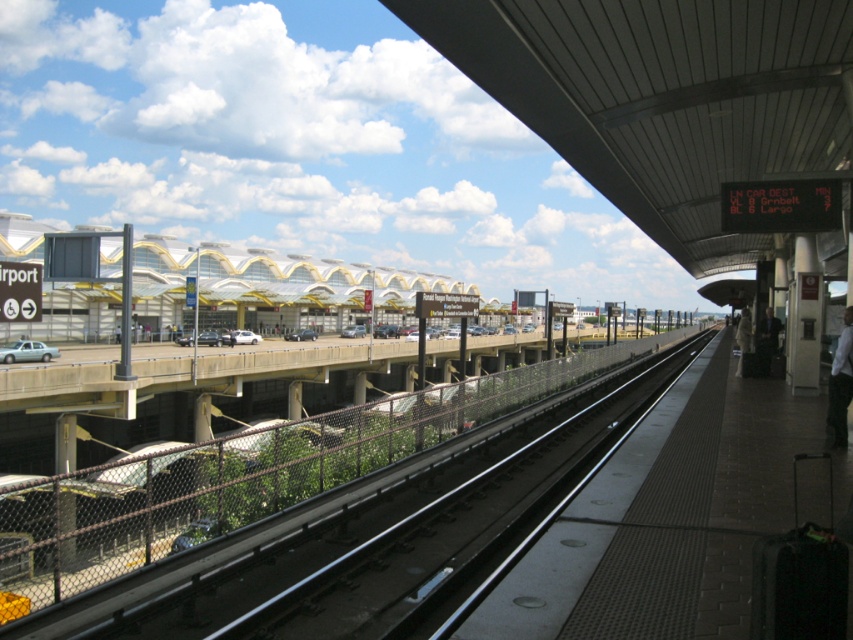
Question: Is metallic smooth train track at center positioned in front of white shirt at right?

Choices:
 (A) yes
 (B) no

Answer: (A)

Question: Considering the real-world distances, which object is farthest from the white fabric bag at platform right?

Choices:
 (A) white shirt at right
 (B) metallic smooth train track at center

Answer: (A)

Question: Does metallic smooth train track at center come in front of white fabric bag at platform right?

Choices:
 (A) yes
 (B) no

Answer: (A)

Question: Which point is closer to the camera?

Choices:
 (A) (831, 388)
 (B) (631, 413)
 (C) (747, 323)

Answer: (A)

Question: From the image, what is the correct spatial relationship of white shirt at right in relation to white fabric bag at platform right?

Choices:
 (A) left
 (B) right

Answer: (A)

Question: Which object is the closest to the white shirt at right?

Choices:
 (A) white fabric bag at platform right
 (B) metallic smooth train track at center

Answer: (B)